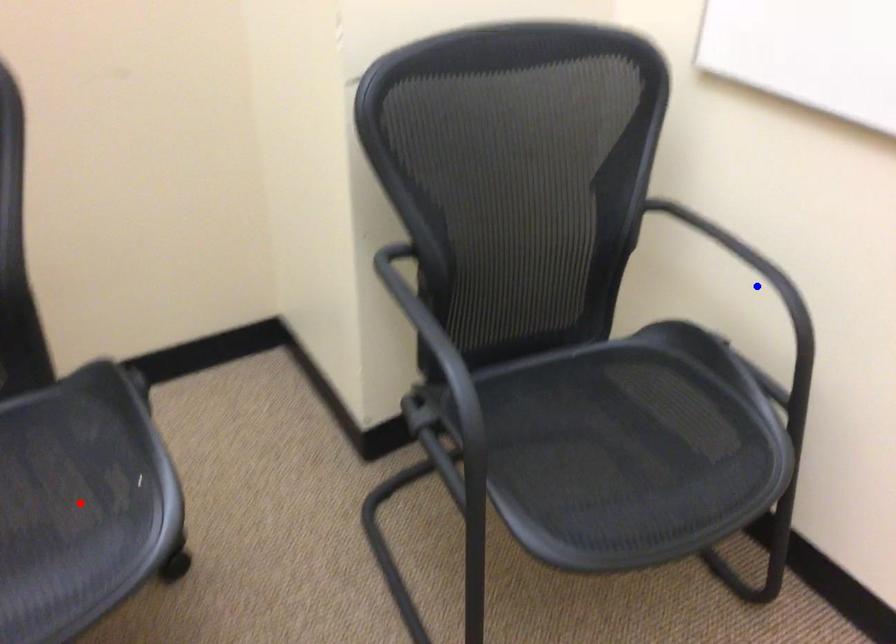
Question: Which of the two points in the image is closer to the camera?

Choices:
 (A) Blue point is closer.
 (B) Red point is closer.

Answer: (B)